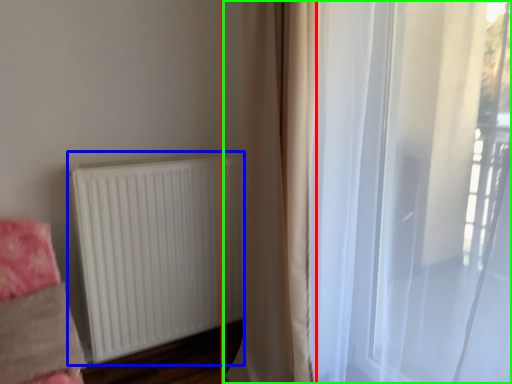
Question: Estimate the real-world distances between objects in this image. Which object is closer to curtain (highlighted by a red box), radiator (highlighted by a blue box) or curtain (highlighted by a green box)?

Choices:
 (A) radiator
 (B) curtain

Answer: (B)